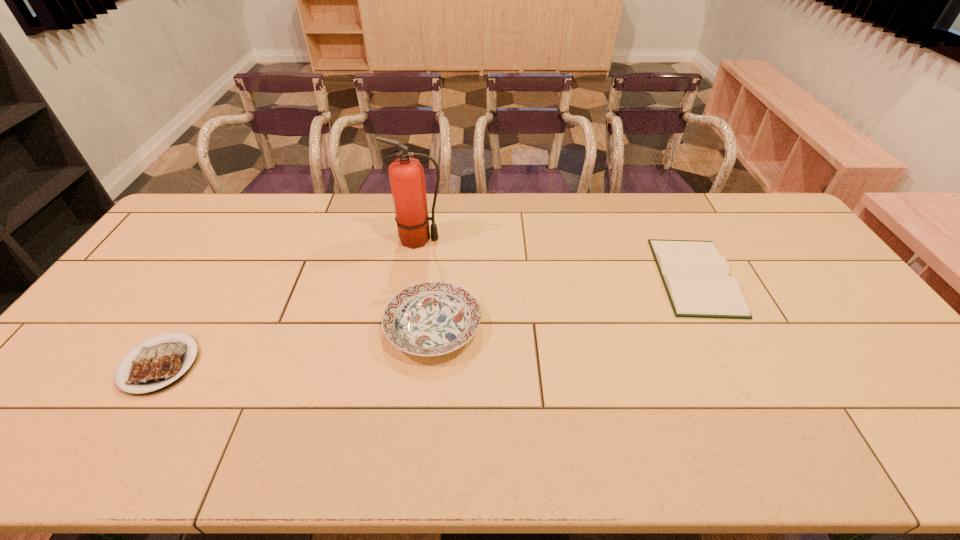
At what (x,y) coordinates should I click in order to perform the action: click on the tallest object. Please return your answer as a coordinate pair (x, y). The image size is (960, 540). Looking at the image, I should click on (406, 174).

You are a GUI agent. You are given a task and a screenshot of the screen. Output one action in this format:
    pyautogui.click(x=<x>, y=<y>)
    Task: Click on the right plate
    This screenshot has width=960, height=540.
    Given the screenshot: What is the action you would take?
    pyautogui.click(x=433, y=318)

Locate an element on the screen. The height and width of the screenshot is (540, 960). the second tallest object is located at coordinates (433, 318).

This screenshot has height=540, width=960. I want to click on the rightmost object, so click(x=696, y=277).

Identify the location of the shorter plate. (157, 365).

Identify the location of the left plate. (157, 365).

This screenshot has width=960, height=540. Identify the location of vacant area located on the nozzle of the tallest object. (471, 240).

At what (x,y) coordinates should I click in order to perform the action: click on blank space located 0.110m on the right of the third shortest object. Please return your answer as a coordinate pair (x, y). Looking at the image, I should click on (521, 327).

You are a GUI agent. You are given a task and a screenshot of the screen. Output one action in this format:
    pyautogui.click(x=<x>, y=<y>)
    Task: Click on the vacant space located 0.200m on the front of the rightmost object
    This screenshot has width=960, height=540.
    Given the screenshot: What is the action you would take?
    pyautogui.click(x=748, y=381)

Where is `free region located on the back of the shorter plate`? free region located on the back of the shorter plate is located at coordinates (202, 296).